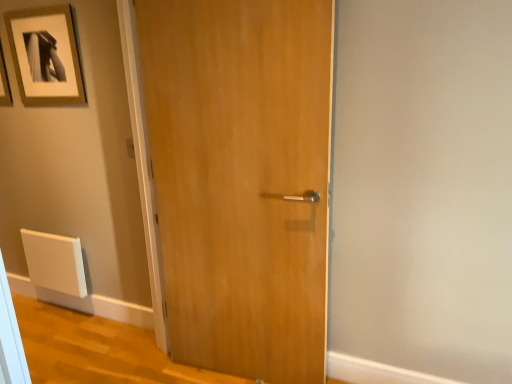
This screenshot has width=512, height=384. I want to click on wooden door at center, so click(x=241, y=179).

What do you see at coordinates (241, 179) in the screenshot? Image resolution: width=512 pixels, height=384 pixels. I see `wooden door at center` at bounding box center [241, 179].

Where is `matte gold picture frame at upper left`? This screenshot has height=384, width=512. matte gold picture frame at upper left is located at coordinates (46, 56).

Describe the element at coordinates (46, 56) in the screenshot. I see `matte gold picture frame at upper left` at that location.

Locate an element on the screen. wooden door at center is located at coordinates (241, 179).

Based on their positions, is matte gold picture frame at upper left located to the left or right of wooden door at center?

In the image, matte gold picture frame at upper left appears on the left side of wooden door at center.

Relative to wooden door at center, is matte gold picture frame at upper left in front or behind?

In the image, matte gold picture frame at upper left appears behind wooden door at center.

Which is more distant, (60, 47) or (259, 222)?

The point (60, 47) is farther.

From the image's perspective, relative to wooden door at center, is matte gold picture frame at upper left above or below?

matte gold picture frame at upper left is situated higher than wooden door at center in the image.

From a real-world perspective, is matte gold picture frame at upper left physically located above or below wooden door at center?

matte gold picture frame at upper left is situated higher than wooden door at center in the real world.

Which of these two, matte gold picture frame at upper left or wooden door at center, is wider?

wooden door at center is wider.

Does matte gold picture frame at upper left have a greater height compared to wooden door at center?

In fact, matte gold picture frame at upper left may be shorter than wooden door at center.

Which of these two, matte gold picture frame at upper left or wooden door at center, is smaller?

matte gold picture frame at upper left.

Would you say wooden door at center is part of matte gold picture frame at upper left's contents?

That's incorrect, wooden door at center is not inside matte gold picture frame at upper left.

Would you consider matte gold picture frame at upper left to be distant from wooden door at center?

No, there isn't a large distance between matte gold picture frame at upper left and wooden door at center.

Is matte gold picture frame at upper left positioned with its back to wooden door at center?

No, matte gold picture frame at upper left is not facing away from wooden door at center.

How different are the orientations of matte gold picture frame at upper left and wooden door at center in degrees?

The angular difference between matte gold picture frame at upper left and wooden door at center is 5.7 degrees.

Find the location of a particular element. Image resolution: width=512 pixels, height=384 pixels. picture frame above the wooden door at center (from the image's perspective) is located at coordinates (46, 56).

In the image, is wooden door at center on the left side or the right side of matte gold picture frame at upper left?

wooden door at center is to the right of matte gold picture frame at upper left.

Is the position of wooden door at center more distant than that of matte gold picture frame at upper left?

No, it is not.

Is point (220, 241) farther from viewer compared to point (63, 37)?

That is False.

From the image's perspective, which is above, wooden door at center or matte gold picture frame at upper left?

matte gold picture frame at upper left.

From a real-world perspective, relative to matte gold picture frame at upper left, is wooden door at center vertically above or below?

wooden door at center is below matte gold picture frame at upper left.

In terms of width, does wooden door at center look wider or thinner when compared to matte gold picture frame at upper left?

wooden door at center is wider than matte gold picture frame at upper left.

Can you confirm if wooden door at center is taller than matte gold picture frame at upper left?

Correct, wooden door at center is much taller as matte gold picture frame at upper left.

Considering the sizes of objects wooden door at center and matte gold picture frame at upper left in the image provided, who is bigger, wooden door at center or matte gold picture frame at upper left?

Bigger between the two is wooden door at center.

Does wooden door at center contain matte gold picture frame at upper left?

No.

Are wooden door at center and matte gold picture frame at upper left making contact?

No, wooden door at center is not next to matte gold picture frame at upper left.

Is wooden door at center aimed at matte gold picture frame at upper left?

No.

What's the angular difference between wooden door at center and matte gold picture frame at upper left's facing directions?

5.7 degrees.

This screenshot has width=512, height=384. I want to click on door in front of the matte gold picture frame at upper left, so click(x=241, y=179).

Locate an element on the screen. Image resolution: width=512 pixels, height=384 pixels. picture frame above the wooden door at center (from a real-world perspective) is located at coordinates (46, 56).

You are a GUI agent. You are given a task and a screenshot of the screen. Output one action in this format:
    pyautogui.click(x=<x>, y=<y>)
    Task: Click on the door on the right of the matte gold picture frame at upper left
    The image size is (512, 384).
    Given the screenshot: What is the action you would take?
    pyautogui.click(x=241, y=179)